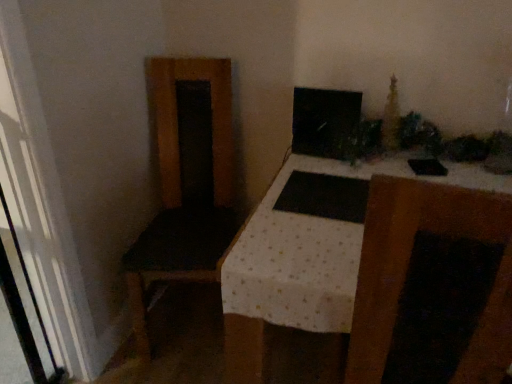
Question: Is matte black monitor at upper center thinner than white textured table at center?

Choices:
 (A) no
 (B) yes

Answer: (B)

Question: Considering the relative sizes of matte black monitor at upper center and white textured table at center in the image provided, is matte black monitor at upper center bigger than white textured table at center?

Choices:
 (A) yes
 (B) no

Answer: (B)

Question: Is matte black monitor at upper center in contact with white textured table at center?

Choices:
 (A) yes
 (B) no

Answer: (B)

Question: Can you confirm if matte black monitor at upper center is positioned to the right of white textured table at center?

Choices:
 (A) no
 (B) yes

Answer: (A)

Question: Is matte black monitor at upper center facing away from white textured table at center?

Choices:
 (A) yes
 (B) no

Answer: (B)

Question: Is matte black monitor at upper center wider than white textured table at center?

Choices:
 (A) yes
 (B) no

Answer: (B)

Question: Are white textured table at center and matte black monitor at upper center beside each other?

Choices:
 (A) yes
 (B) no

Answer: (B)

Question: Is white textured table at center wider than matte black monitor at upper center?

Choices:
 (A) no
 (B) yes

Answer: (B)

Question: From a real-world perspective, is white textured table at center physically below matte black monitor at upper center?

Choices:
 (A) no
 (B) yes

Answer: (B)

Question: From the image's perspective, is white textured table at center located beneath matte black monitor at upper center?

Choices:
 (A) no
 (B) yes

Answer: (B)

Question: Is white textured table at center further to the viewer compared to matte black monitor at upper center?

Choices:
 (A) yes
 (B) no

Answer: (B)

Question: From a real-world perspective, is white textured table at center physically above matte black monitor at upper center?

Choices:
 (A) yes
 (B) no

Answer: (B)

Question: Is matte black monitor at upper center wider or thinner than white textured table at center?

Choices:
 (A) thin
 (B) wide

Answer: (A)